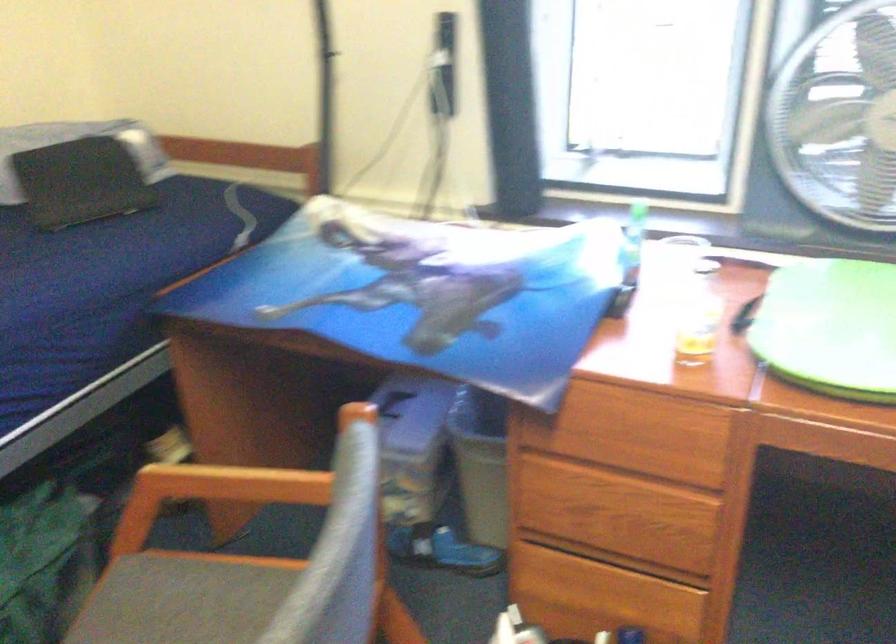
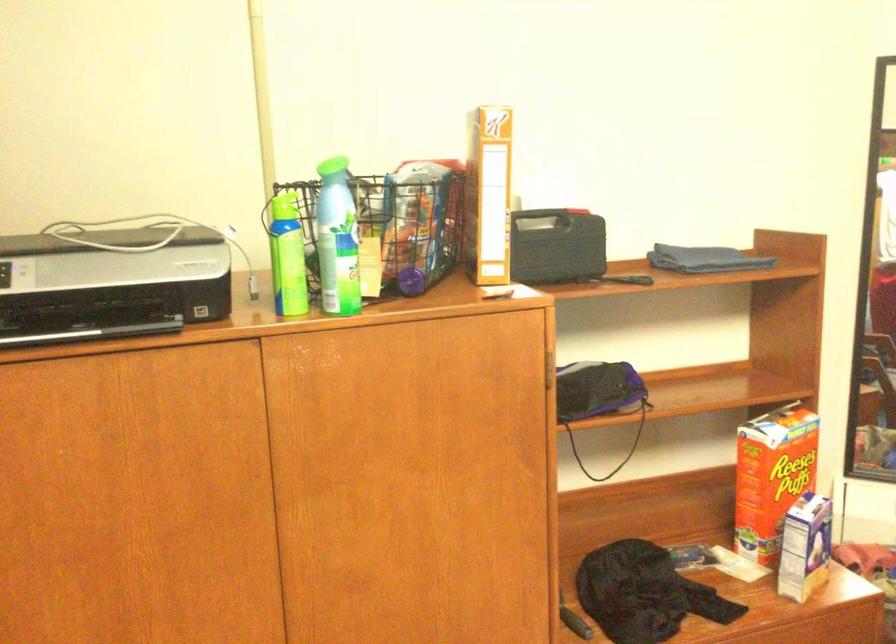
Question: The first image is from the beginning of the video and the second image is from the end. How did the camera likely rotate when shooting the video?

Choices:
 (A) Left
 (B) Right
 (C) Up
 (D) Down

Answer: (A)